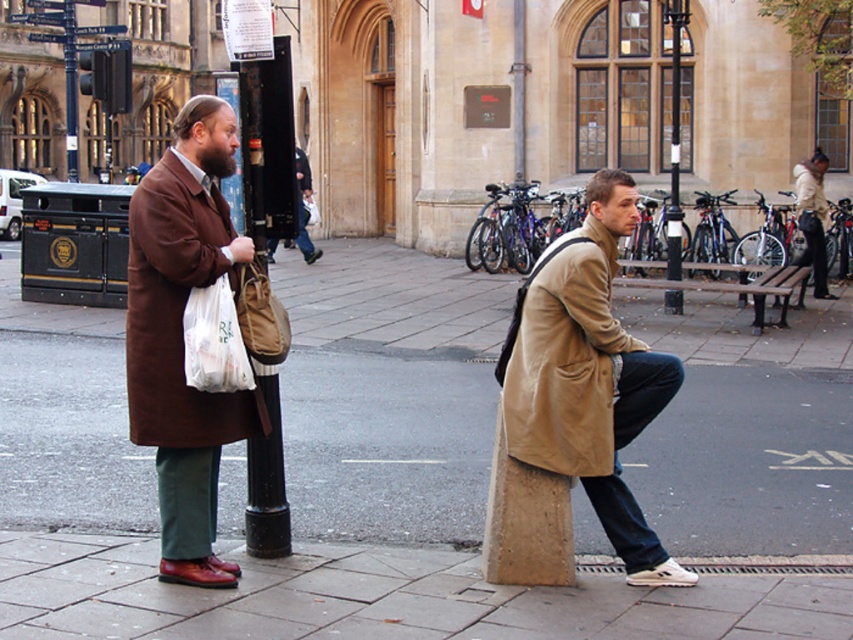
Which is more to the right, brown wool coat at left or black metal pole at upper center?

black metal pole at upper center

Is brown wool coat at left smaller than black metal pole at upper center?

No, brown wool coat at left is not smaller than black metal pole at upper center.

Which is behind, point (218, 188) or point (672, 275)?

Positioned behind is point (672, 275).

Locate an element on the screen. The height and width of the screenshot is (640, 853). brown wool coat at left is located at coordinates (177, 314).

Is translucent plastic bag at left further to camera compared to black metal pole at upper center?

No.

How distant is translucent plastic bag at left from black metal pole at upper center?

translucent plastic bag at left is 10.53 meters away from black metal pole at upper center.

At what (x,y) coordinates should I click in order to perform the action: click on translucent plastic bag at left. Please return your answer as a coordinate pair (x, y). This screenshot has height=640, width=853. Looking at the image, I should click on (213, 340).

Is smooth concrete pavement at lower center smaller than beige woolen trench coat at lower center?

Indeed, smooth concrete pavement at lower center has a smaller size compared to beige woolen trench coat at lower center.

Can you confirm if smooth concrete pavement at lower center is positioned below beige woolen trench coat at lower center?

Yes, smooth concrete pavement at lower center is below beige woolen trench coat at lower center.

Between point (56, 589) and point (587, 369), which one is positioned in front?

Positioned in front is point (587, 369).

In order to click on smooth concrete pavement at lower center in this screenshot , I will do `click(384, 596)`.